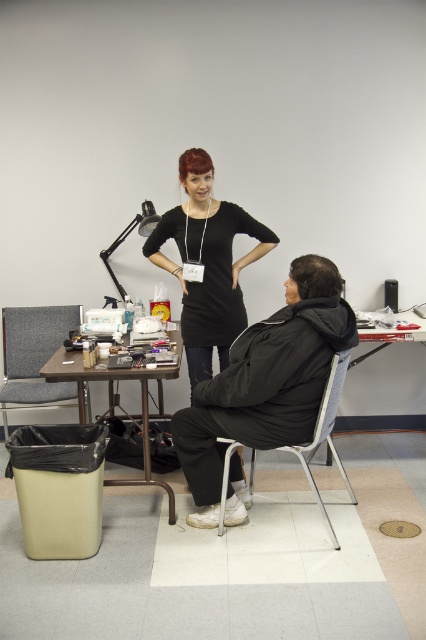
Question: Which point is closer to the camera?

Choices:
 (A) dark red hair at upper center
 (B) gray fabric chair at left
 (C) matte black jacket at center
 (D) dark brown hair at right

Answer: (C)

Question: From the image, what is the correct spatial relationship of black matte dress at center in relation to metallic silver table at lower left?

Choices:
 (A) below
 (B) above

Answer: (B)

Question: Among these points, which one is farthest from the camera?

Choices:
 (A) (43, 374)
 (B) (198, 180)
 (C) (322, 394)

Answer: (B)

Question: Is matte black jacket at center positioned at the back of gray fabric chair at left?

Choices:
 (A) yes
 (B) no

Answer: (B)

Question: Estimate the real-world distances between objects in this image. Which object is farther from the metallic silver table at lower left?

Choices:
 (A) gray fabric chair at left
 (B) metallic silver chair at lower center
 (C) black matte dress at center
 (D) matte black jacket at center

Answer: (B)

Question: Does matte black jacket at center appear on the right side of metallic silver table at lower left?

Choices:
 (A) yes
 (B) no

Answer: (A)